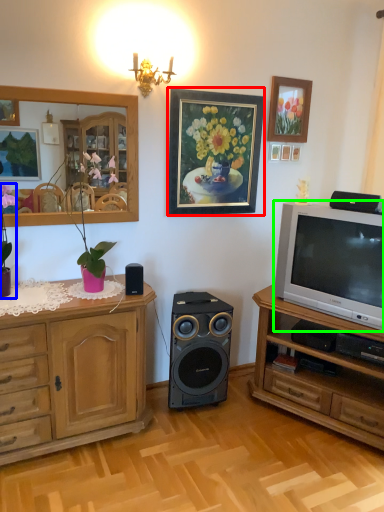
Question: Based on their relative distances, which object is nearer to picture frame (highlighted by a red box)? Choose from houseplant (highlighted by a blue box) and television (highlighted by a green box).

Choices:
 (A) houseplant
 (B) television

Answer: (B)